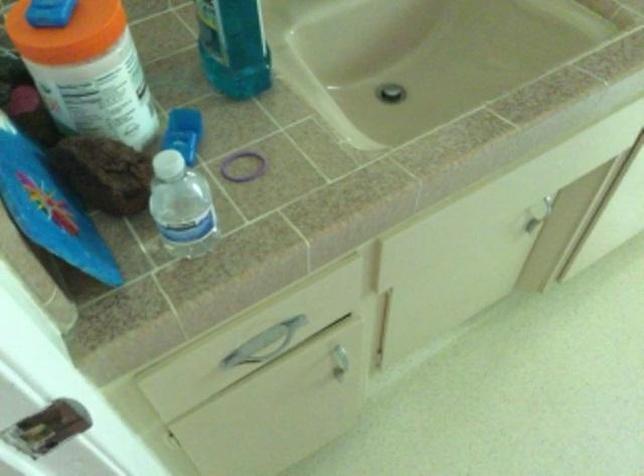
This screenshot has height=476, width=644. Identify the location of clear water bottle. (181, 205).